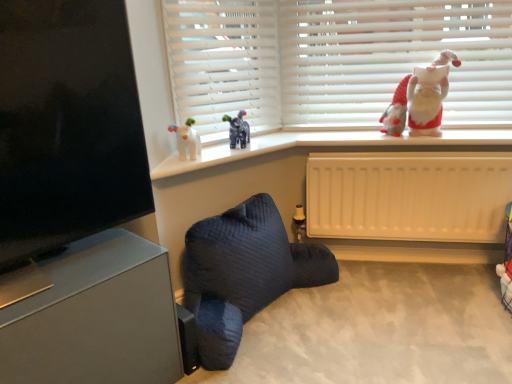
Question: In terms of width, does dark blue quilted bean bag chair at lower center look wider or thinner when compared to white ceramic santa at upper right?

Choices:
 (A) thin
 (B) wide

Answer: (B)

Question: Is dark blue quilted bean bag chair at lower center in front of or behind white ceramic santa at upper right in the image?

Choices:
 (A) behind
 (B) front

Answer: (B)

Question: Which object is positioned farthest from the black matte screen at upper left?

Choices:
 (A) white matte blinds at upper center
 (B) dark blue quilted bean bag chair at lower center
 (C) white ceramic santa at upper right
 (D) white matte blinds at upper center
 (E) white plastic window sill at upper center

Answer: (C)

Question: Considering the real-world distances, which object is farthest from the white plastic window sill at upper center?

Choices:
 (A) dark blue quilted bean bag chair at lower center
 (B) white ceramic santa at upper right
 (C) white plastic radiator at lower center
 (D) black matte screen at upper left
 (E) matte gray speaker at lower left

Answer: (E)